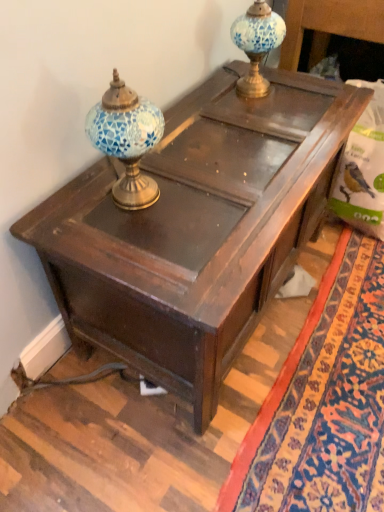
Find the location of `vacant space in between blue mosaic glass lamp at upper left, the 2th candle holder from the back, and blue mosaic glass lamp at upper center, the first candle holder when ordered from right to left`. vacant space in between blue mosaic glass lamp at upper left, the 2th candle holder from the back, and blue mosaic glass lamp at upper center, the first candle holder when ordered from right to left is located at coordinates (211, 126).